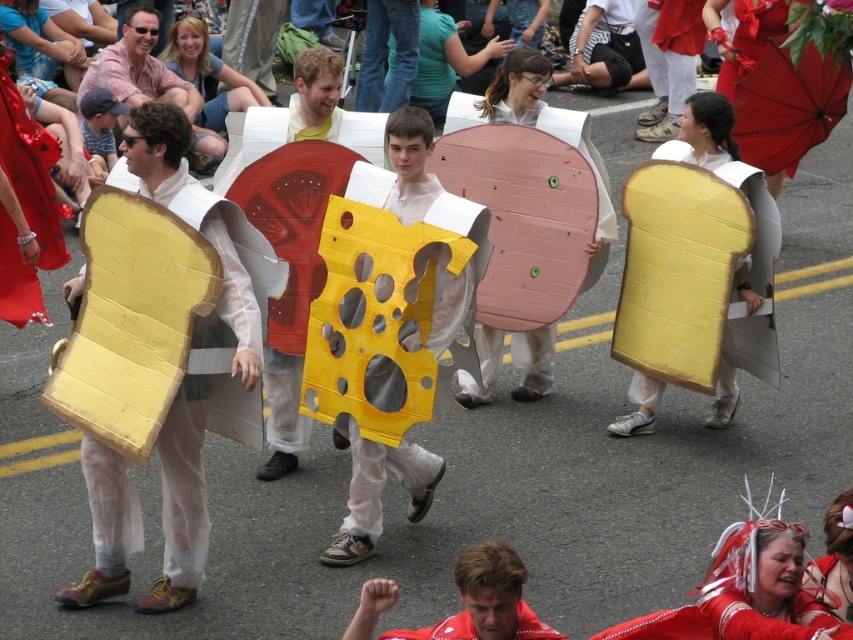
You are a photographer standing at the origin point of the scene. You want to take a photo of the yellow matte cheese at center. According to the coordinates provided, where should you aim your camera?

The yellow matte cheese at center is located at point (383, 480), so you should aim your camera towards that coordinate to capture it.

You are a photographer at the event and want to take a picture of the yellow matte cheese at center and the matte red shirt at center. Which one appears narrower in the photo?

The yellow matte cheese at center appears narrower than the matte red shirt at center in the photo because it is thinner.